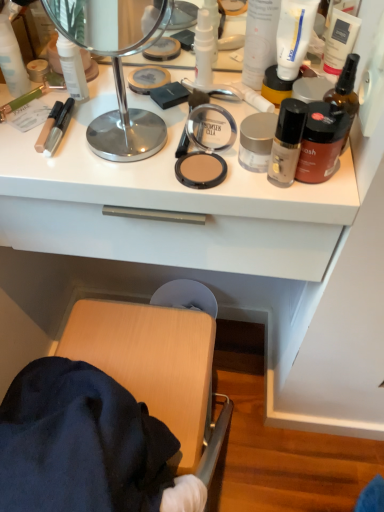
This screenshot has width=384, height=512. In order to click on blank space to the left of yellow matte jar at upper right, the 4th toiletry from the right in this screenshot , I will do `click(176, 105)`.